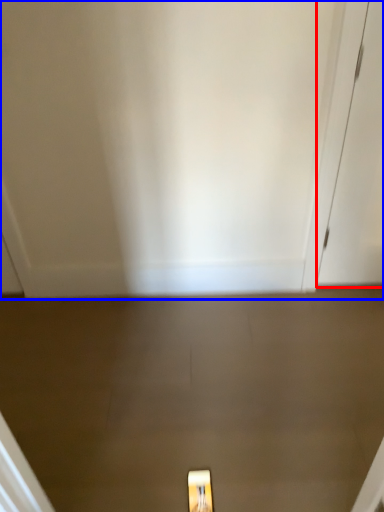
Question: Which object appears farthest to the camera in this image, door (highlighted by a red box) or door (highlighted by a blue box)?

Choices:
 (A) door
 (B) door

Answer: (A)